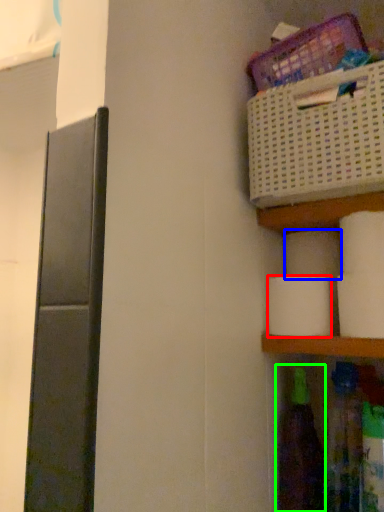
Question: Which object is positioned closest to toilet paper (highlighted by a red box)? Select from toilet paper (highlighted by a blue box) and bottle (highlighted by a green box).

Choices:
 (A) toilet paper
 (B) bottle

Answer: (A)